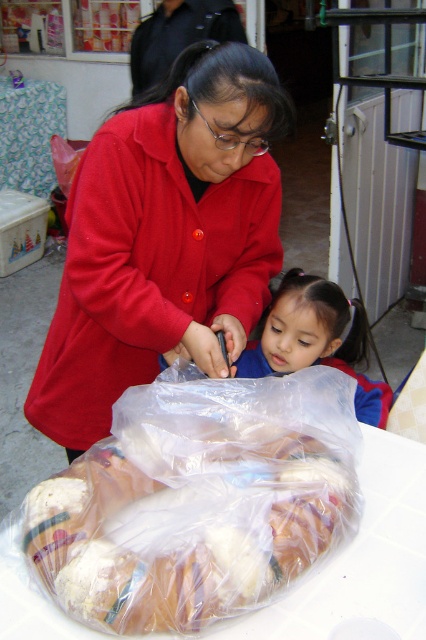
The image size is (426, 640). What do you see at coordinates (198, 499) in the screenshot? I see `translucent plastic bag at center` at bounding box center [198, 499].

Who is more forward, (x=238, y=609) or (x=189, y=326)?

Point (x=238, y=609)

Where is `translucent plastic bag at center`? Image resolution: width=426 pixels, height=640 pixels. translucent plastic bag at center is located at coordinates (198, 499).

Between matte red coat at center and blue fabric jacket at center, which one is positioned lower?

blue fabric jacket at center is below.

Measure the distance between matte red coat at center and blue fabric jacket at center.

They are 35.38 centimeters apart.

Describe the element at coordinates (164, 237) in the screenshot. I see `matte red coat at center` at that location.

The width and height of the screenshot is (426, 640). Identify the location of matte red coat at center. (164, 237).

Can you confirm if translucent plastic bag at center is smaller than blue fabric jacket at center?

No.

Can you confirm if translucent plastic bag at center is positioned above blue fabric jacket at center?

No.

What do you see at coordinates (198, 499) in the screenshot? This screenshot has height=640, width=426. I see `translucent plastic bag at center` at bounding box center [198, 499].

I want to click on translucent plastic bag at center, so click(x=198, y=499).